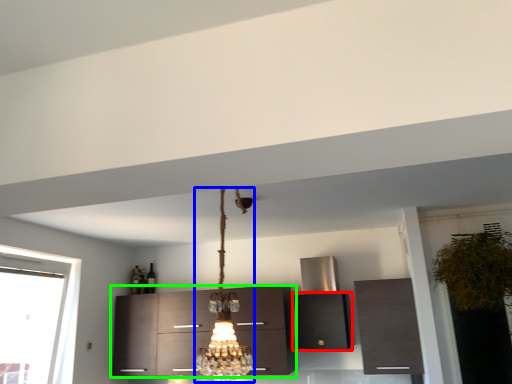
Question: Based on their relative distances, which object is nearer to cabinetry (highlighted by a red box)? Choose from lamp (highlighted by a blue box) and cabinetry (highlighted by a green box).

Choices:
 (A) lamp
 (B) cabinetry

Answer: (B)